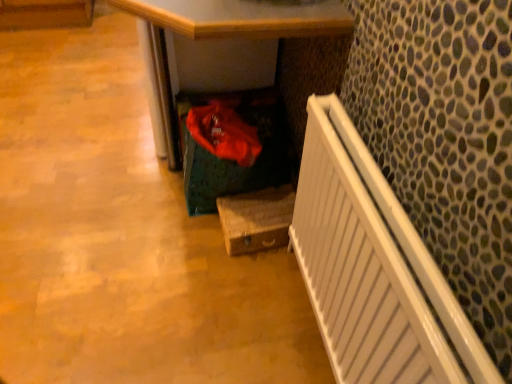
Locate an element on the screen. This screenshot has height=384, width=512. vacant space to the left of wooden at lower center is located at coordinates (74, 107).